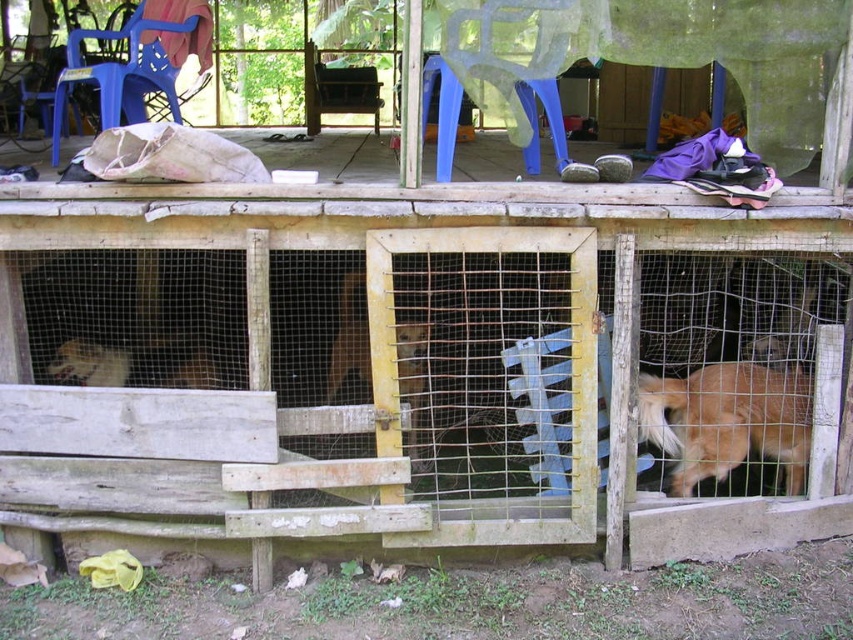
Between point (264, 449) and point (763, 444), which one is positioned in front?

Point (264, 449)

Measure the distance between wooden wire cage at center and golden fur dog at lower right.

20.24 inches

Locate an element on the screen. This screenshot has width=853, height=640. wooden wire cage at center is located at coordinates (426, 365).